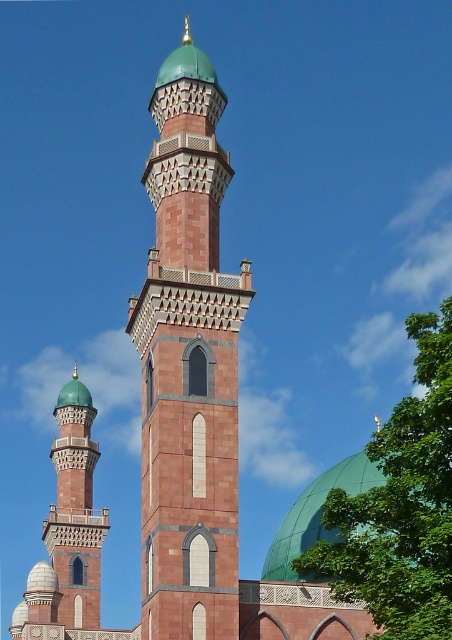
Does reddish-brown stone minaret at center have a lesser height compared to green glossy dome at center?

Incorrect, reddish-brown stone minaret at center's height does not fall short of green glossy dome at center's.

Looking at this image, is reddish-brown stone minaret at center further to camera compared to green glossy dome at center?

Yes, reddish-brown stone minaret at center is further from the viewer.

Between point (149, 548) and point (321, 486), which one is positioned behind?

Point (321, 486)

The width and height of the screenshot is (452, 640). I want to click on reddish-brown stone minaret at center, so click(x=188, y=365).

Can you confirm if matte red brick minaret at left is smaller than green glossy dome at center?

No.

Describe the element at coordinates (69, 525) in the screenshot. I see `matte red brick minaret at left` at that location.

Which is behind, point (66, 394) or point (316, 502)?

The point (66, 394) is behind.

This screenshot has height=640, width=452. What are the coordinates of `matte red brick minaret at left` in the screenshot? It's located at (69, 525).

Between reddish-brown stone minaret at center and matte red brick minaret at left, which one appears on the right side from the viewer's perspective?

From the viewer's perspective, reddish-brown stone minaret at center appears more on the right side.

Can you confirm if reddish-brown stone minaret at center is smaller than matte red brick minaret at left?

No.

Image resolution: width=452 pixels, height=640 pixels. What do you see at coordinates (188, 365) in the screenshot? I see `reddish-brown stone minaret at center` at bounding box center [188, 365].

Locate an element on the screen. This screenshot has height=640, width=452. reddish-brown stone minaret at center is located at coordinates (188, 365).